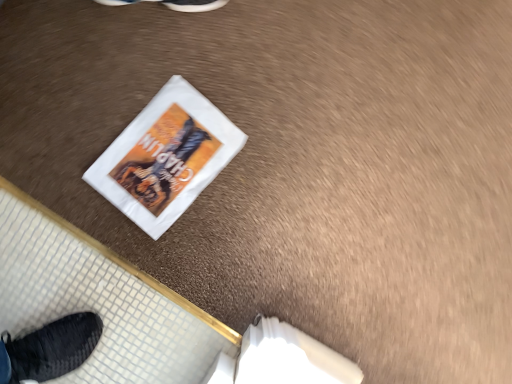
This screenshot has height=384, width=512. What do you see at coordinates (166, 157) in the screenshot?
I see `white paper flyer at center` at bounding box center [166, 157].

In order to face white paper flyer at center, should I rotate leftwards or rightwards?

You should look left and rotate roughly 11.734 degrees.

You are a GUI agent. You are given a task and a screenshot of the screen. Output one action in this format:
    pyautogui.click(x=<x>, y=<y>)
    Task: Click on the white paper flyer at center
    This screenshot has width=512, height=384.
    Given the screenshot: What is the action you would take?
    pyautogui.click(x=166, y=157)

You are a GUI agent. You are given a task and a screenshot of the screen. Output one action in this format:
    pyautogui.click(x=<x>, y=<y>)
    Task: Click on the white paper flyer at center
    The image size is (512, 384).
    Given the screenshot: What is the action you would take?
    pyautogui.click(x=166, y=157)